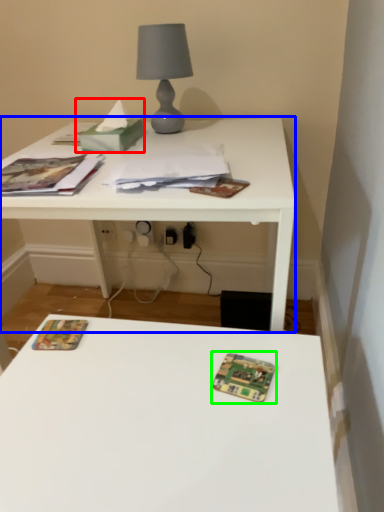
Question: Which object is the farthest from tissue (highlighted by a red box)? Choose among these: table (highlighted by a blue box) or card game (highlighted by a green box).

Choices:
 (A) table
 (B) card game

Answer: (B)